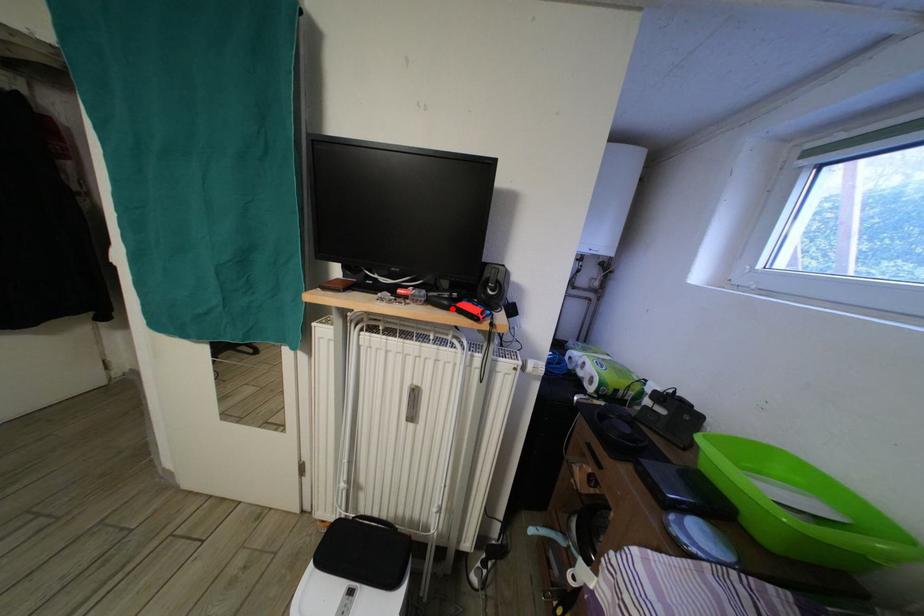
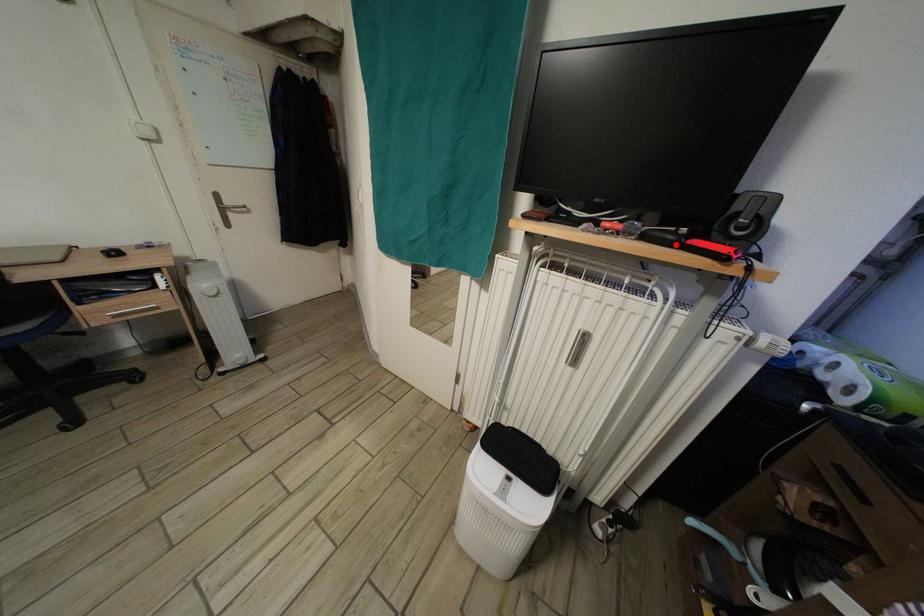
I am providing you with two images of the same scene from different viewpoints. A red point is marked on the first image and another point is marked on the second image. Is the marked point in image1 the same physical position as the marked point in image2?

Yes